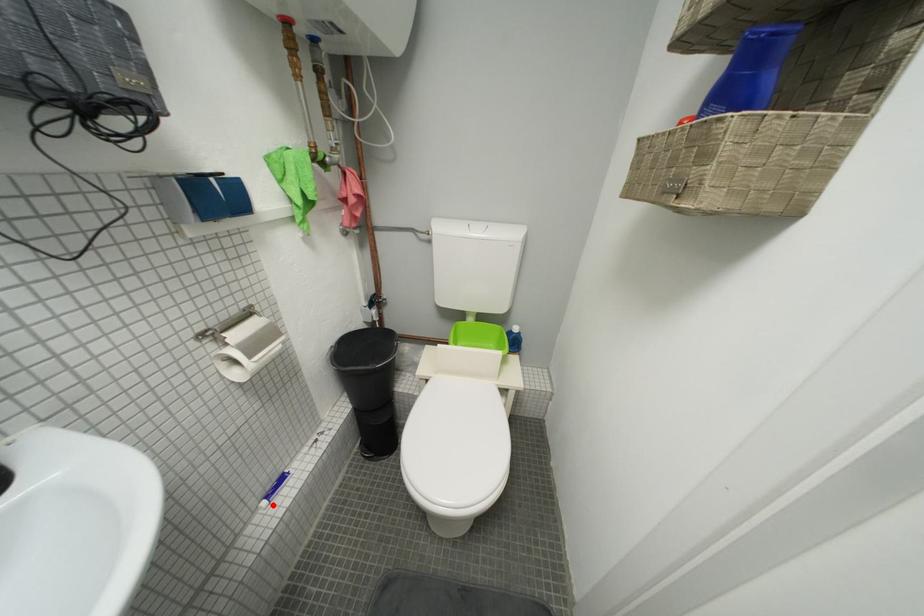
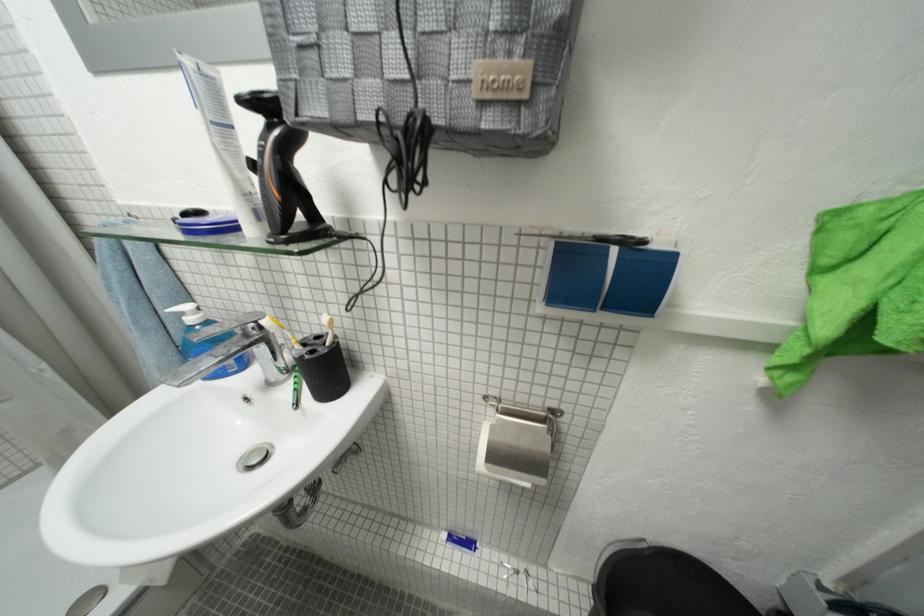
Locate, in the second image, the point that corresponds to the highlighted location in the first image.

(454, 538)